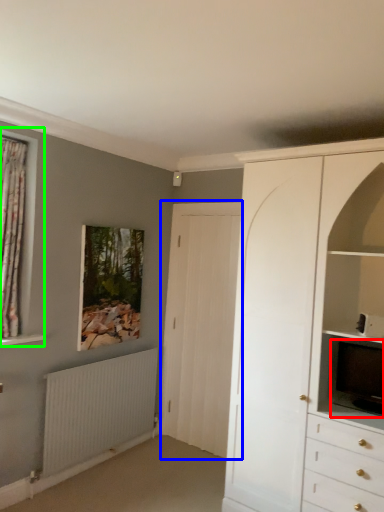
Question: Which is nearer to the television (highlighted by a red box)? door (highlighted by a blue box) or window (highlighted by a green box).

Choices:
 (A) door
 (B) window

Answer: (A)